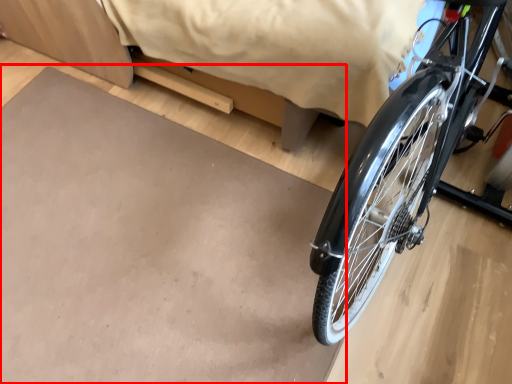
Question: From the image's perspective, where is slate (annotated by the red box) located relative to bed?

Choices:
 (A) below
 (B) above

Answer: (A)